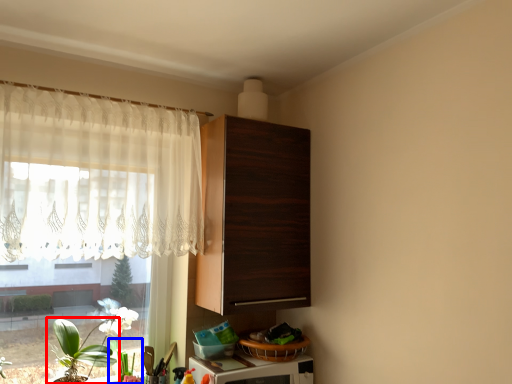
Question: Which object is further to the camera taking this photo, houseplant (highlighted by a red box) or plant (highlighted by a blue box)?

Choices:
 (A) houseplant
 (B) plant

Answer: (B)